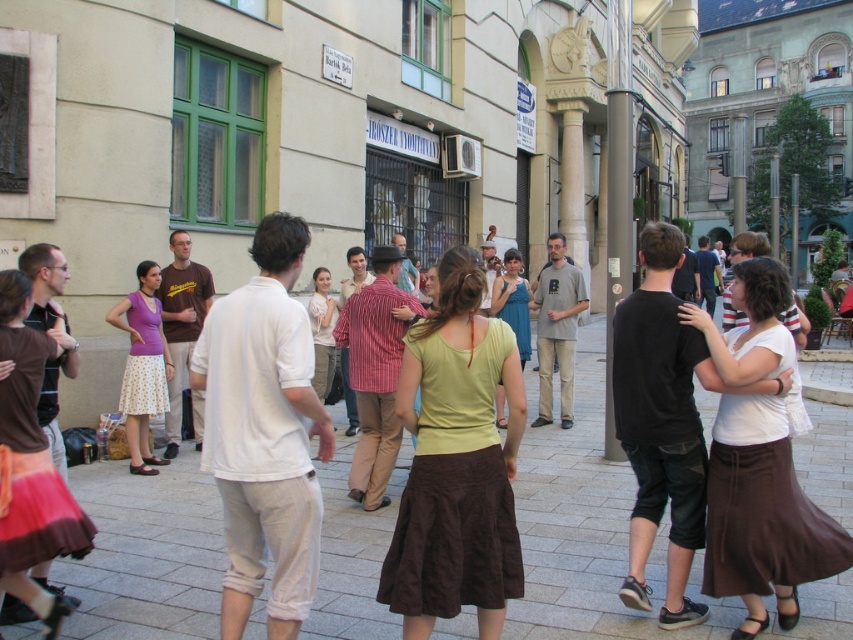
Can you confirm if brown fabric skirt at center is smaller than white cotton shirt at center?

Yes, brown fabric skirt at center is smaller than white cotton shirt at center.

Between brown fabric skirt at center and white cotton shirt at center, which one appears on the right side from the viewer's perspective?

Positioned to the right is brown fabric skirt at center.

Where is `brown fabric skirt at center`? This screenshot has height=640, width=853. brown fabric skirt at center is located at coordinates (587, 532).

Where is `brown fabric skirt at center`? Image resolution: width=853 pixels, height=640 pixels. brown fabric skirt at center is located at coordinates (587, 532).

Between brown fabric skirt at center and matte purple tank top at left, which one has less height?

Standing shorter between the two is brown fabric skirt at center.

Does point (582, 609) come closer to viewer compared to point (131, 412)?

Yes, point (582, 609) is in front of point (131, 412).

Where is `brown fabric skirt at center`? The image size is (853, 640). brown fabric skirt at center is located at coordinates (587, 532).

Find the location of a particular element. The height and width of the screenshot is (640, 853). green cotton shirt at center is located at coordinates (456, 464).

Based on the photo, how much distance is there between green cotton shirt at center and matte purple tank top at left?

A distance of 4.78 meters exists between green cotton shirt at center and matte purple tank top at left.

Which is in front, point (517, 424) or point (125, 413)?

Point (517, 424)

Identify the location of green cotton shirt at center. pyautogui.click(x=456, y=464).